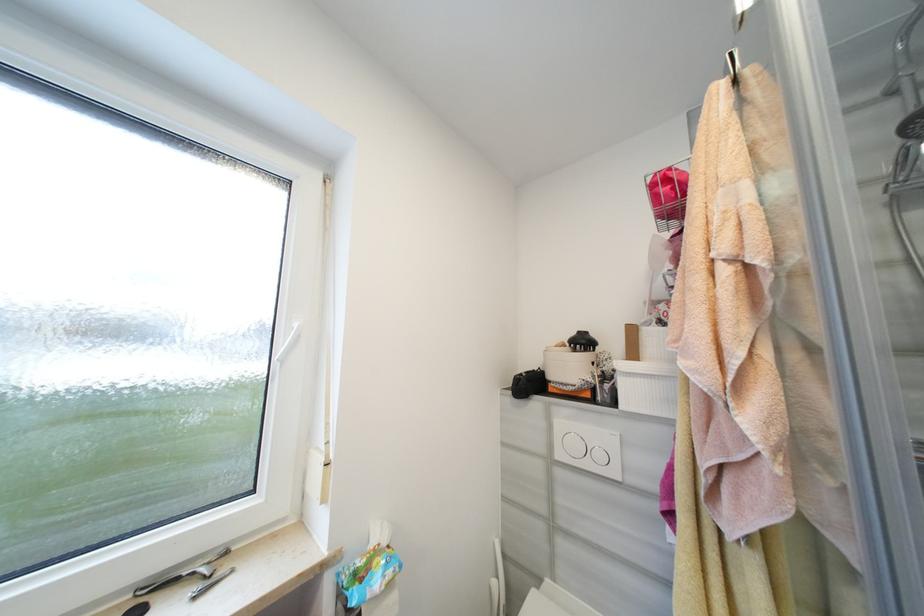
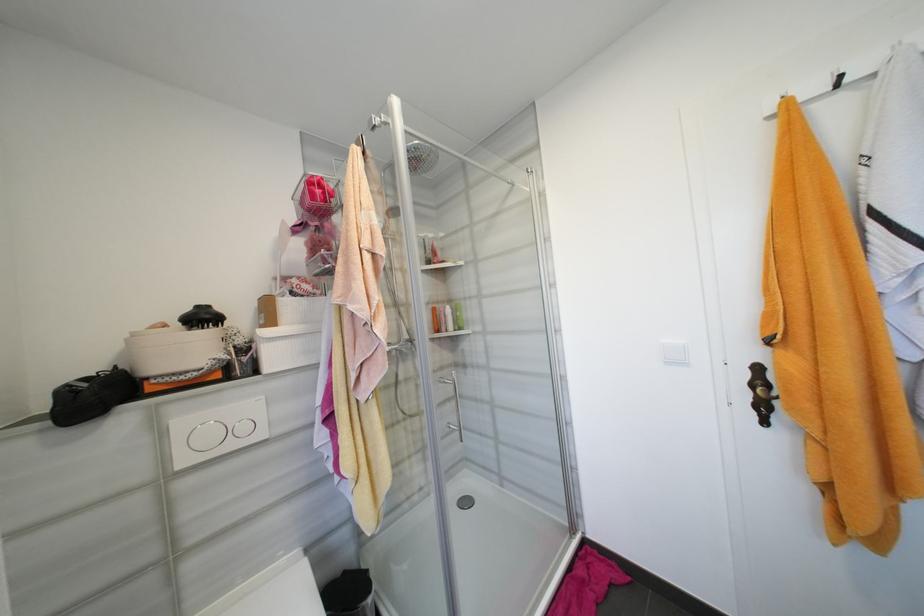
Question: The camera is either moving clockwise (left) or counter-clockwise (right) around the object. The first image is from the beginning of the video and the second image is from the end. Is the camera moving left or right when shooting the video?

Choices:
 (A) Left
 (B) Right

Answer: (A)